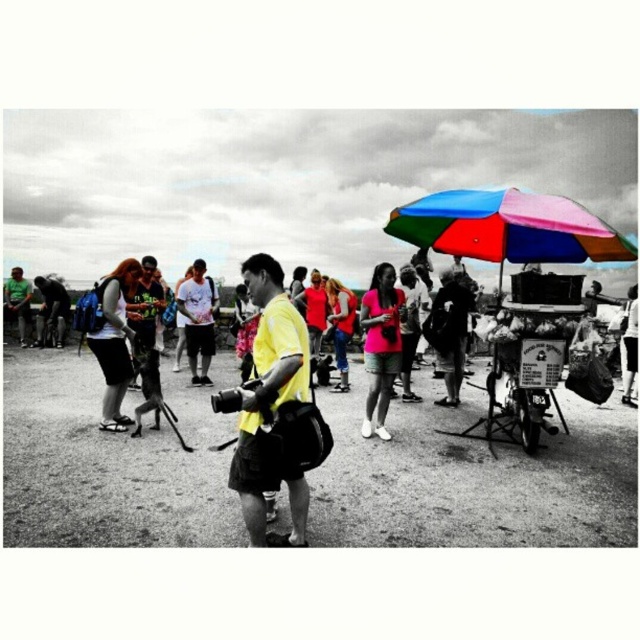
You are a photographer in the scene. You notice the dirt field at center and the matte black shorts at lower left. Which object is located below the other?

The dirt field at center is positioned under matte black shorts at lower left, meaning the dirt field is below the matte black shorts at lower left.

You are a photographer at the event and want to ensure your subject under the multicolored fabric umbrella at upper right is visible. Is the yellow matte shirt at center blocking the view?

The multicolored fabric umbrella at upper right is positioned over the yellow matte shirt at center, so the yellow matte shirt at center is blocking the view of the subject under the umbrella.